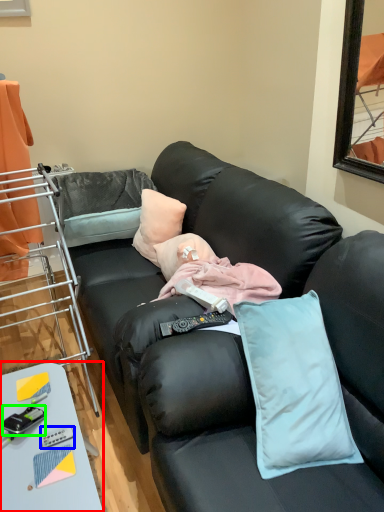
Question: Estimate the real-world distances between objects in this image. Which object is farther from table (highlighted by a red box), equipment (highlighted by a blue box) or equipment (highlighted by a green box)?

Choices:
 (A) equipment
 (B) equipment

Answer: (A)